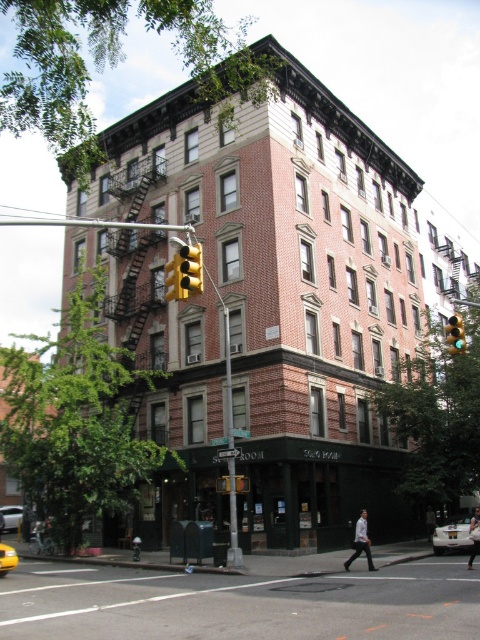
Between yellow plastic traffic light at center and green glass traffic light at upper right, which one appears on the left side from the viewer's perspective?

Positioned to the left is yellow plastic traffic light at center.

Between yellow plastic traffic light at center and green glass traffic light at upper right, which one has less height?

green glass traffic light at upper right

Where is `yellow plastic traffic light at center`? yellow plastic traffic light at center is located at coordinates (175, 280).

Find the location of a particular element. yellow plastic traffic light at center is located at coordinates (175, 280).

Who is positioned more to the left, concrete sidewalk at lower center or green glass traffic light at upper right?

Positioned to the left is concrete sidewalk at lower center.

Is point (84, 625) positioned after point (460, 317)?

No.

Identify the location of concrete sidewalk at lower center. (240, 604).

Locate an element on the screen. concrete sidewalk at lower center is located at coordinates (240, 604).

Who is positioned more to the right, green glass traffic light at upper right or dark gray jacket at lower right?

From the viewer's perspective, green glass traffic light at upper right appears more on the right side.

Is green glass traffic light at upper right closer to camera compared to dark gray jacket at lower right?

Yes, it is in front of dark gray jacket at lower right.

Between point (462, 333) and point (425, 516), which one is positioned in front?

Point (462, 333)

Where is `green glass traffic light at upper right`? The height and width of the screenshot is (640, 480). green glass traffic light at upper right is located at coordinates (455, 333).